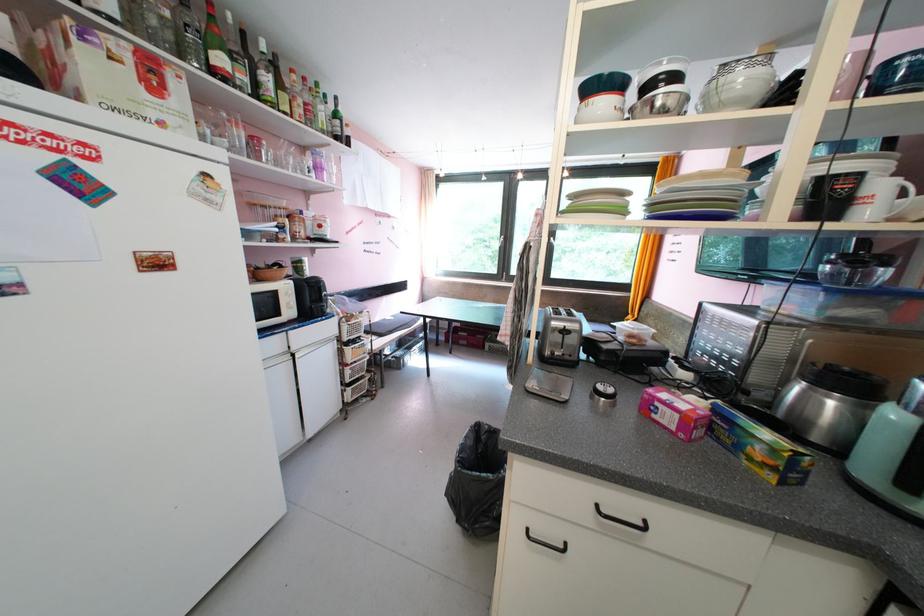
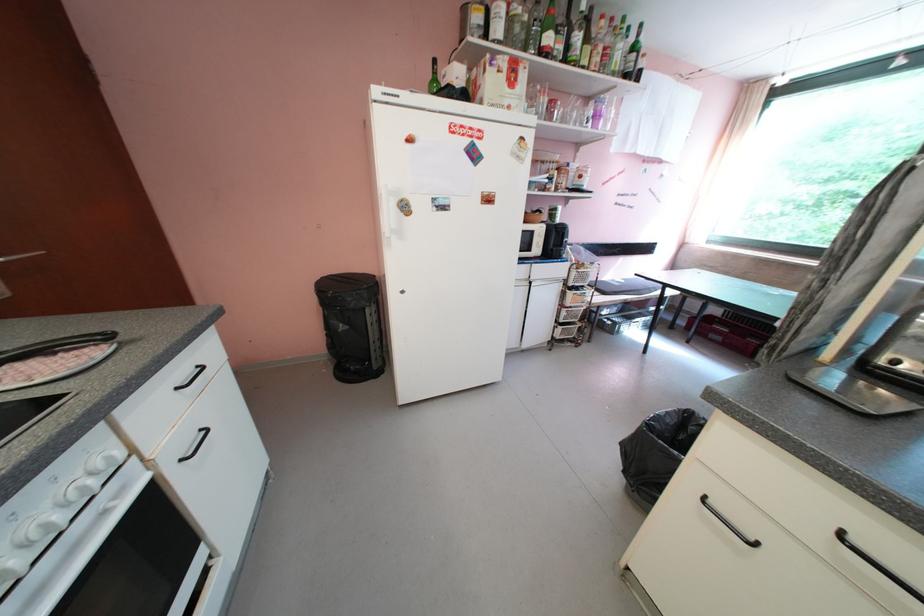
The point at (357, 320) is marked in the first image. Where is the corresponding point in the second image?

(588, 268)